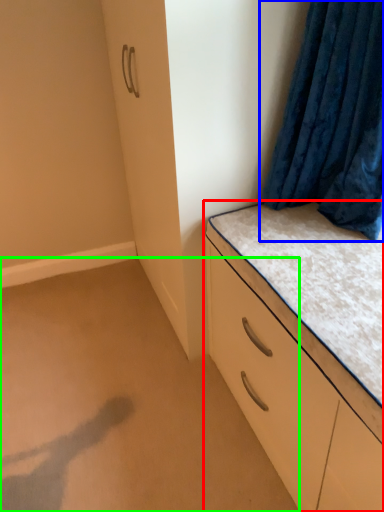
Question: Which object is the closest to the chest of drawers (highlighted by a red box)? Choose among these: curtain (highlighted by a blue box) or plain (highlighted by a green box).

Choices:
 (A) curtain
 (B) plain

Answer: (A)